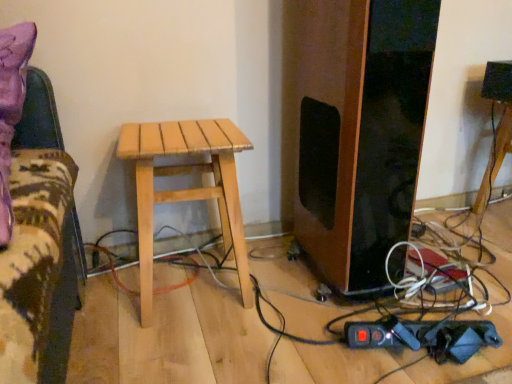
Find the location of `free location in front of natural wood stool at center`. free location in front of natural wood stool at center is located at coordinates (184, 345).